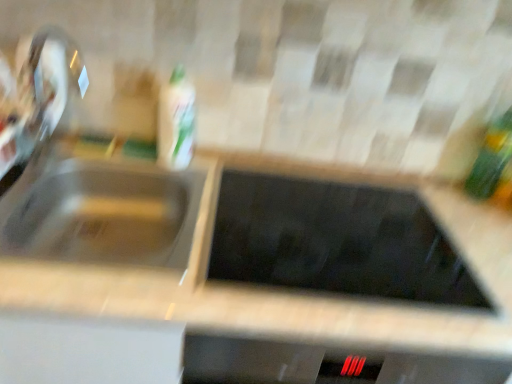
In order to click on vacant space situated on the left part of white glossy bottle at upper center, which is the 1th bottle in left-to-right order in this screenshot , I will do `click(110, 155)`.